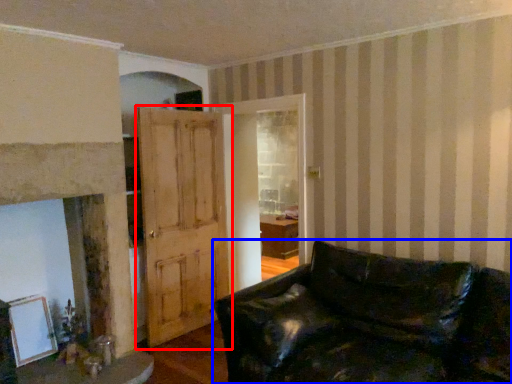
Question: Which object is closer to the camera taking this photo, door (highlighted by a red box) or studio couch (highlighted by a blue box)?

Choices:
 (A) door
 (B) studio couch

Answer: (B)